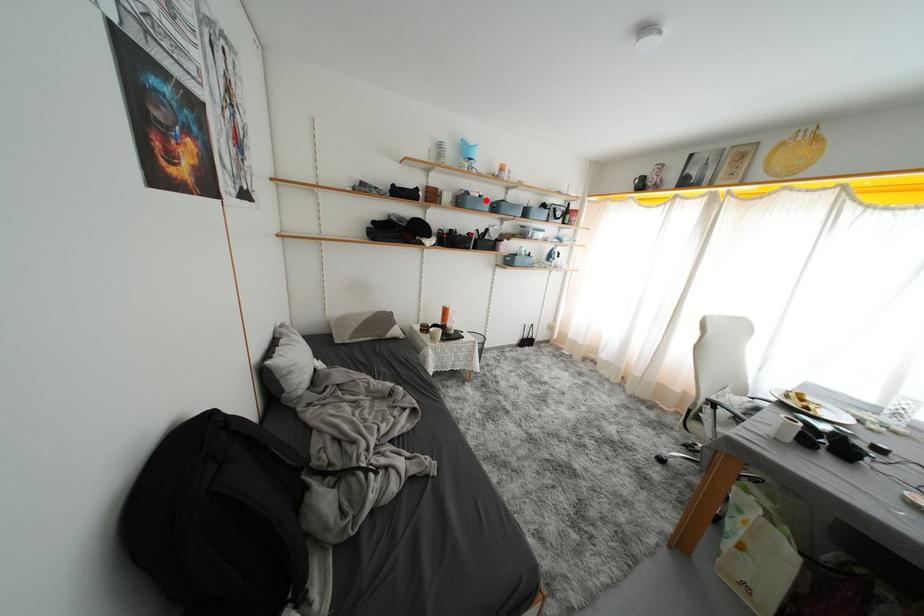
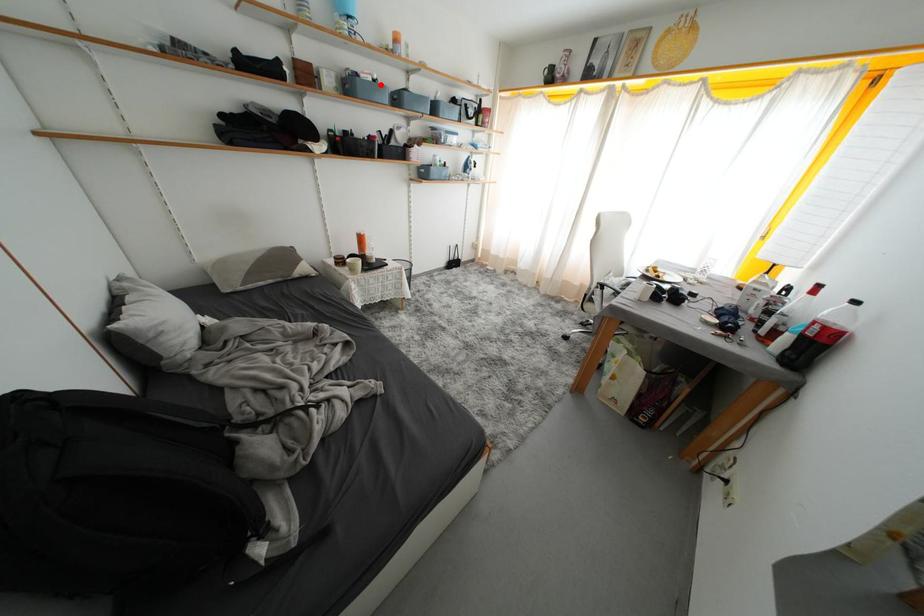
I am providing you with two images of the same scene from different viewpoints. A red point is marked on the first image and another point is marked on the second image. Does the point marked in image1 correspond to the same location as the one in image2?

Yes